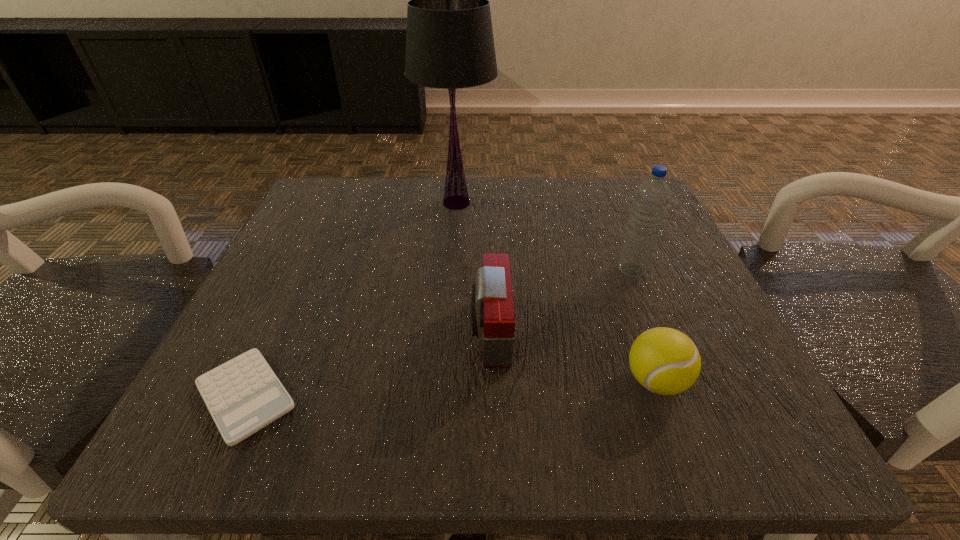
The height and width of the screenshot is (540, 960). In order to click on blank space located 0.280m on the front-facing side of the camera in this screenshot , I will do `click(285, 331)`.

Identify the location of free space located 0.340m on the front-facing side of the camera. (245, 331).

Where is `vacant position located 0.270m on the front-facing side of the camera`? vacant position located 0.270m on the front-facing side of the camera is located at coordinates (292, 331).

Find the location of a particular element. The width and height of the screenshot is (960, 540). vacant space located 0.080m on the back of the tennis ball is located at coordinates (633, 315).

Locate an element on the screen. Image resolution: width=960 pixels, height=540 pixels. vacant space located on the back of the leftmost object is located at coordinates (327, 220).

You are a GUI agent. You are given a task and a screenshot of the screen. Output one action in this format:
    pyautogui.click(x=<x>, y=<y>)
    Task: Click on the object located in the far edge section of the desktop
    This screenshot has width=960, height=540.
    Given the screenshot: What is the action you would take?
    pyautogui.click(x=449, y=41)

Where is `tennis ball located in the near edge section of the desktop`? Image resolution: width=960 pixels, height=540 pixels. tennis ball located in the near edge section of the desktop is located at coordinates (665, 361).

Identify the location of calculator present at the near edge. This screenshot has height=540, width=960. (243, 395).

Identify the location of object that is at the left edge. This screenshot has width=960, height=540. click(x=243, y=395).

Where is `water bottle at the right edge`? The width and height of the screenshot is (960, 540). water bottle at the right edge is located at coordinates (652, 196).